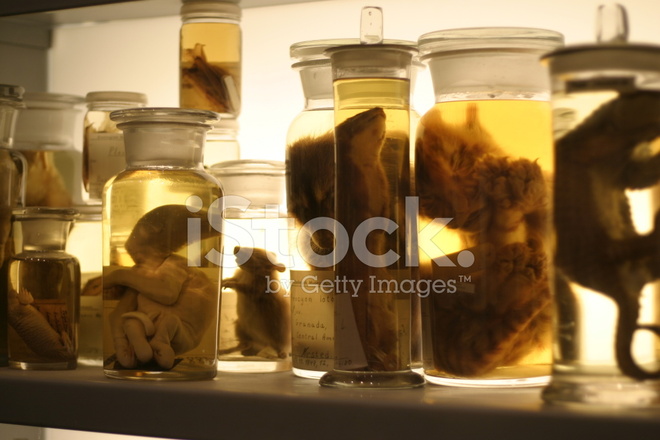
I want to click on shelf, so click(294, 390).